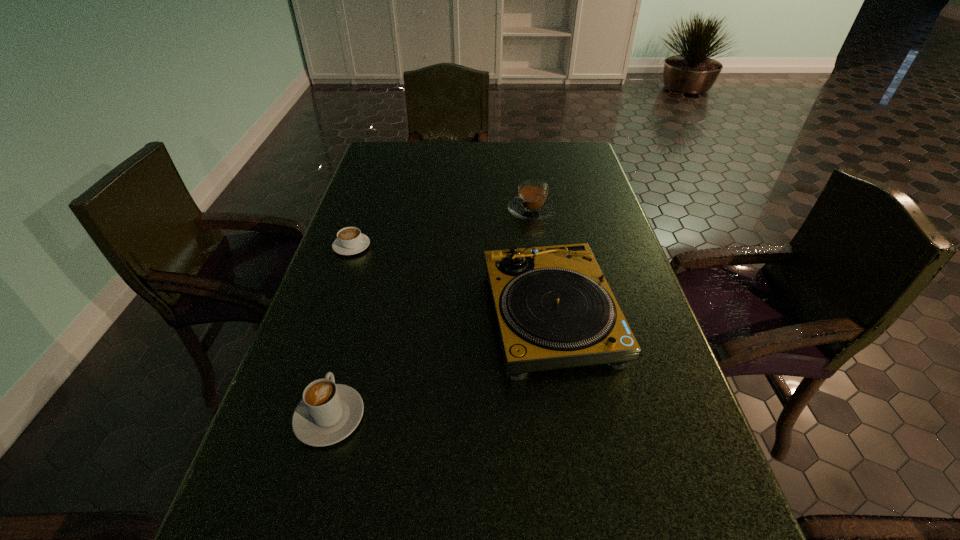
You are a GUI agent. You are given a task and a screenshot of the screen. Output one action in this format:
    pyautogui.click(x=<x>, y=<y>)
    Task: Click on the free space that satisfies the following two spatial constraints: 1. on the side of the shortest object with the handle; 2. on the back side of the third farthest object
    Image resolution: width=960 pixels, height=540 pixels.
    Given the screenshot: What is the action you would take?
    pyautogui.click(x=327, y=315)

At what (x,y) coordinates should I click in order to perform the action: click on free region that satisfies the following two spatial constraints: 1. to the right of the nearest object; 2. on the side of the shortest object with the handle. Please return your answer as a coordinate pair (x, y). This screenshot has width=960, height=540. Looking at the image, I should click on (377, 246).

I want to click on free space that satisfies the following two spatial constraints: 1. to the right of the nearest cappuccino; 2. on the side of the shortest object with the handle, so click(377, 246).

I want to click on free location that satisfies the following two spatial constraints: 1. to the right of the nearest cappuccino; 2. on the side of the second nearest cappuccino with the handle, so pyautogui.click(x=377, y=246).